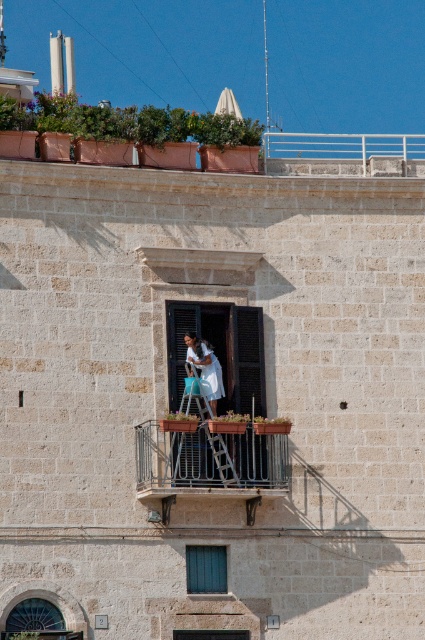
Question: Among these objects, which one is farthest from the camera?

Choices:
 (A) metallic silver ladder at center
 (B) green matte window at center
 (C) rustic wood balcony at center

Answer: (B)

Question: Can you confirm if rustic wood balcony at center is positioned below dark gray stone window at lower left?

Choices:
 (A) no
 (B) yes

Answer: (A)

Question: Which of these objects is positioned closest to the dark gray stone window at lower left?

Choices:
 (A) green matte window at center
 (B) matte stone window at center
 (C) metallic silver ladder at center

Answer: (B)

Question: Is rustic wood balcony at center wider than white cotton dress at center?

Choices:
 (A) no
 (B) yes

Answer: (B)

Question: Does green matte window at center have a lesser width compared to dark gray stone window at lower left?

Choices:
 (A) no
 (B) yes

Answer: (B)

Question: Which of these objects is positioned closest to the green matte window at center?

Choices:
 (A) metallic silver ladder at center
 (B) matte stone window at center
 (C) white cotton dress at center

Answer: (B)